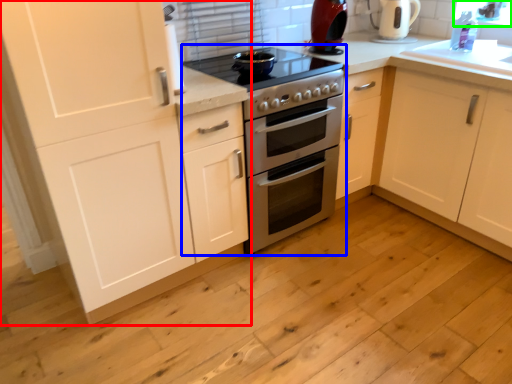
Question: Which object is the closest to the cabinetry (highlighted by a red box)? Choose among these: appliance (highlighted by a blue box) or window screen (highlighted by a green box).

Choices:
 (A) appliance
 (B) window screen

Answer: (A)